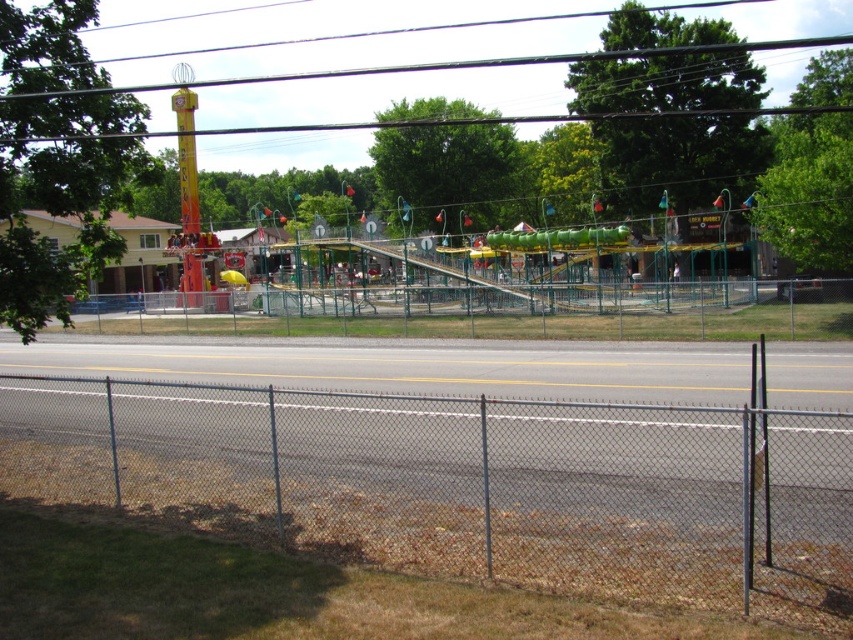
Question: Which point appears closest to the camera in this image?

Choices:
 (A) (409, 262)
 (B) (694, 522)

Answer: (B)

Question: Does gray chain-link fence at lower center have a larger size compared to green metallic slide at center?

Choices:
 (A) yes
 (B) no

Answer: (B)

Question: Is gray chain-link fence at lower center behind green metallic slide at center?

Choices:
 (A) no
 (B) yes

Answer: (A)

Question: Does gray chain-link fence at lower center appear over green metallic slide at center?

Choices:
 (A) yes
 (B) no

Answer: (B)

Question: Which point is closer to the camera?

Choices:
 (A) (467, 266)
 (B) (74, 467)

Answer: (B)

Question: Which of the following is the closest to the observer?

Choices:
 (A) (438, 273)
 (B) (265, 506)

Answer: (B)